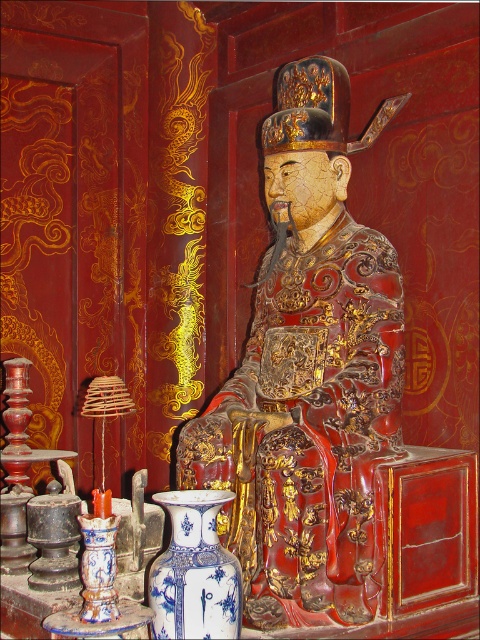
Can you confirm if glossy wood statue at center is shorter than blue porcelain vase at center?

No.

This screenshot has height=640, width=480. I want to click on glossy wood statue at center, so click(307, 378).